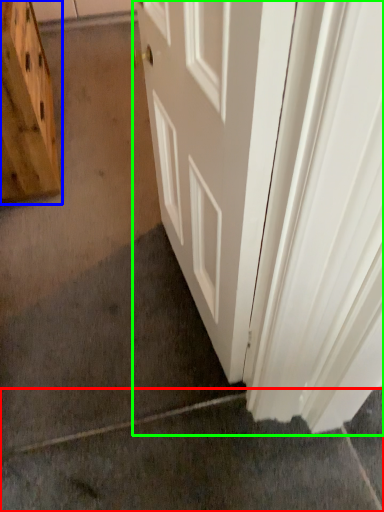
Question: Which is nearer to the concrete (highlighted by a red box)? cabinetry (highlighted by a blue box) or door (highlighted by a green box).

Choices:
 (A) cabinetry
 (B) door

Answer: (B)